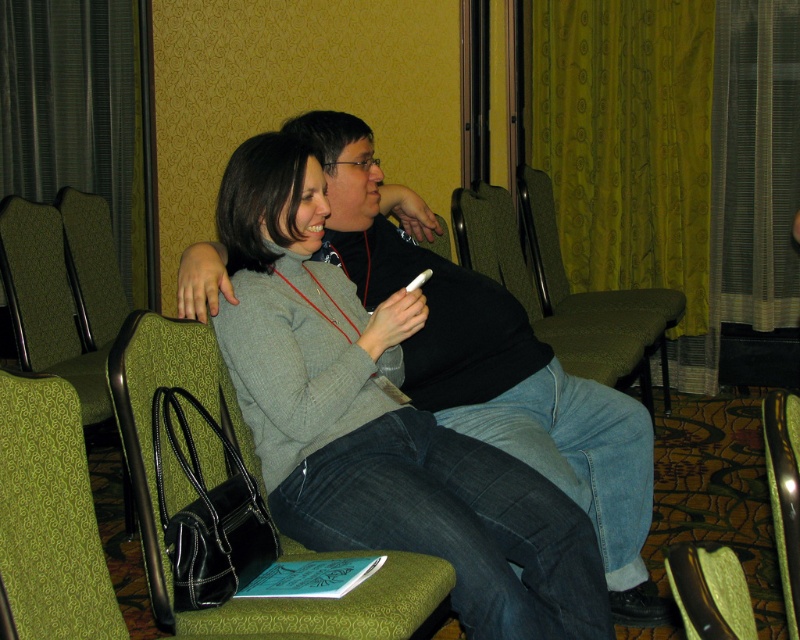
Between green fabric chair at center and brown leather armchair at lower right, which one appears on the right side from the viewer's perspective?

green fabric chair at center is more to the right.

Between point (656, 296) and point (712, 604), which one is positioned in front?

Positioned in front is point (712, 604).

What are the coordinates of `green fabric chair at center` in the screenshot? It's located at (592, 291).

Looking at this image, which is below, matte gray sweater at center or green fabric armchair at lower right?

green fabric armchair at lower right is below.

Which is above, matte gray sweater at center or green fabric armchair at lower right?

Positioned higher is matte gray sweater at center.

Is point (294, 157) closer to camera compared to point (768, 438)?

No.

You are a GUI agent. You are given a task and a screenshot of the screen. Output one action in this format:
    pyautogui.click(x=<x>, y=<y>)
    Task: Click on the matte gray sweater at center
    The width and height of the screenshot is (800, 640).
    Given the screenshot: What is the action you would take?
    pyautogui.click(x=381, y=424)

Who is taller, green fabric armchair at center or green fabric armchair at lower left?

green fabric armchair at center is taller.

Describe the element at coordinates (262, 488) in the screenshot. I see `green fabric armchair at center` at that location.

Identify the location of green fabric armchair at center. Image resolution: width=800 pixels, height=640 pixels. (262, 488).